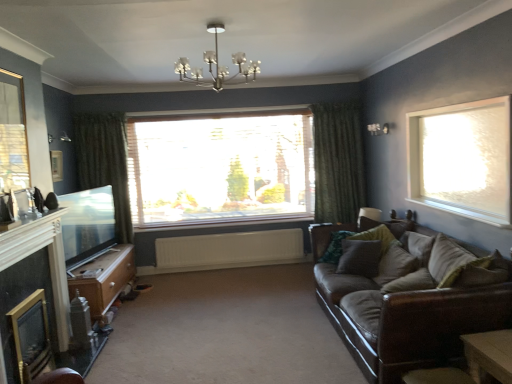
Find the location of `free spot above metallic chandelier at upper center (from a real-world perspective)`. free spot above metallic chandelier at upper center (from a real-world perspective) is located at coordinates (218, 29).